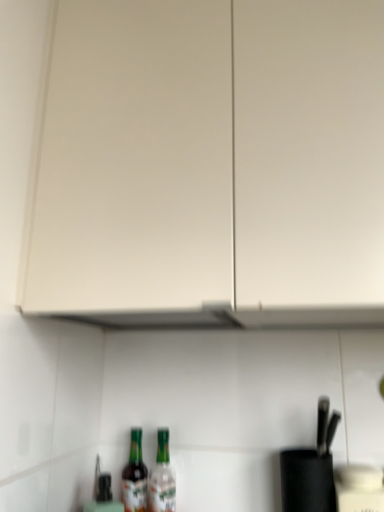
Question: Is white matte cabinet at upper center to the right of green glass bottle at lower center, which is the 1th bottle in left-to-right order, from the viewer's perspective?

Choices:
 (A) yes
 (B) no

Answer: (A)

Question: Is white matte cabinet at upper center outside green glass bottle at lower center, which is the 1th bottle in left-to-right order?

Choices:
 (A) yes
 (B) no

Answer: (A)

Question: Is white matte cabinet at upper center turned away from green glass bottle at lower center, the 2th bottle in the right-to-left sequence?

Choices:
 (A) yes
 (B) no

Answer: (B)

Question: From a real-world perspective, is white matte cabinet at upper center on top of green glass bottle at lower center, which is the 1th bottle in left-to-right order?

Choices:
 (A) no
 (B) yes

Answer: (B)

Question: Is white matte cabinet at upper center placed right next to green glass bottle at lower center, the 2th bottle in the right-to-left sequence?

Choices:
 (A) no
 (B) yes

Answer: (A)

Question: Is point (61, 218) closer or farther from the camera than point (172, 495)?

Choices:
 (A) farther
 (B) closer

Answer: (B)

Question: Is white matte cabinet at upper center in front of or behind translucent glass bottle at lower center, the first bottle in the right-to-left sequence, in the image?

Choices:
 (A) behind
 (B) front

Answer: (B)

Question: Is white matte cabinet at upper center wider or thinner than translucent glass bottle at lower center, the first bottle in the right-to-left sequence?

Choices:
 (A) thin
 (B) wide

Answer: (B)

Question: From a real-world perspective, is white matte cabinet at upper center physically located above or below translucent glass bottle at lower center, the first bottle in the right-to-left sequence?

Choices:
 (A) above
 (B) below

Answer: (A)

Question: From the image's perspective, is translucent glass bottle at lower center, the first bottle in the right-to-left sequence, positioned above or below white matte cabinet at upper center?

Choices:
 (A) below
 (B) above

Answer: (A)

Question: Considering the positions of translucent glass bottle at lower center, the first bottle in the right-to-left sequence, and white matte cabinet at upper center in the image, is translucent glass bottle at lower center, the first bottle in the right-to-left sequence, taller or shorter than white matte cabinet at upper center?

Choices:
 (A) tall
 (B) short

Answer: (B)

Question: Looking at their shapes, would you say translucent glass bottle at lower center, which is the second bottle from left to right, is wider or thinner than white matte cabinet at upper center?

Choices:
 (A) wide
 (B) thin

Answer: (B)

Question: Looking at the image, does translucent glass bottle at lower center, which is the second bottle from left to right, seem bigger or smaller compared to white matte cabinet at upper center?

Choices:
 (A) small
 (B) big

Answer: (A)

Question: Which is correct: green glass bottle at lower center, which is the 1th bottle in left-to-right order, is inside white matte cabinet at upper center, or outside of it?

Choices:
 (A) inside
 (B) outside

Answer: (B)

Question: Visually, is green glass bottle at lower center, which is the 1th bottle in left-to-right order, positioned to the left or to the right of white matte cabinet at upper center?

Choices:
 (A) right
 (B) left

Answer: (B)